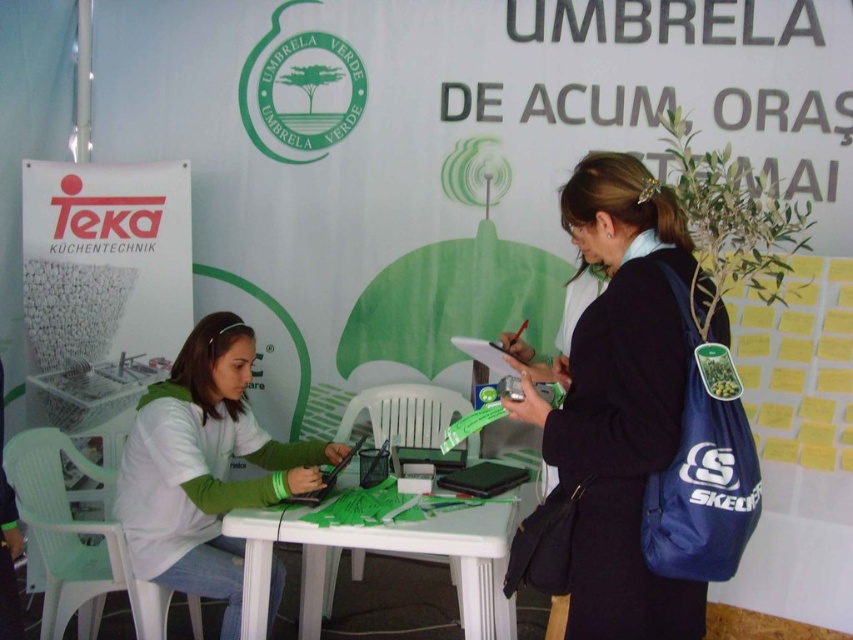
Does blue fabric bag at center have a greater height compared to white plastic table at center?

Correct, blue fabric bag at center is much taller as white plastic table at center.

Which is behind, point (614, 173) or point (329, 593)?

Point (329, 593)

Is point (608, 528) positioned in front of point (302, 560)?

Yes, it is.

The width and height of the screenshot is (853, 640). In order to click on blue fabric bag at center in this screenshot , I will do `click(619, 397)`.

Who is positioned more to the right, green matte shirt at center or white plastic table at center?

white plastic table at center

The image size is (853, 640). Describe the element at coordinates (206, 467) in the screenshot. I see `green matte shirt at center` at that location.

Locate an element on the screen. green matte shirt at center is located at coordinates click(x=206, y=467).

Who is positioned more to the left, white plastic table at center or matte black laptop at center?

matte black laptop at center

Is point (438, 516) positioned before point (297, 502)?

That is True.

Between point (521, 508) and point (338, 464), which one is positioned in front?

Point (338, 464)

Image resolution: width=853 pixels, height=640 pixels. I want to click on white plastic table at center, so click(x=386, y=552).